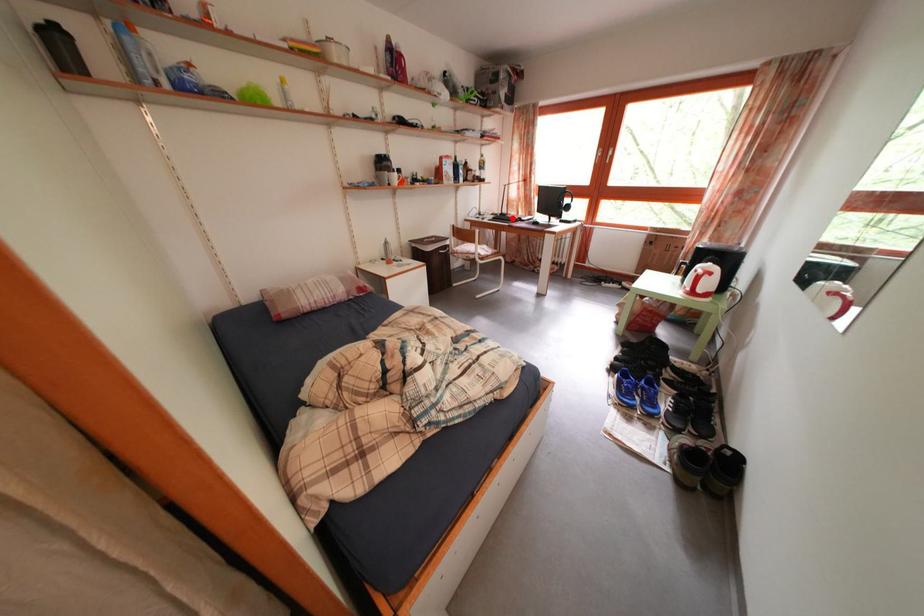
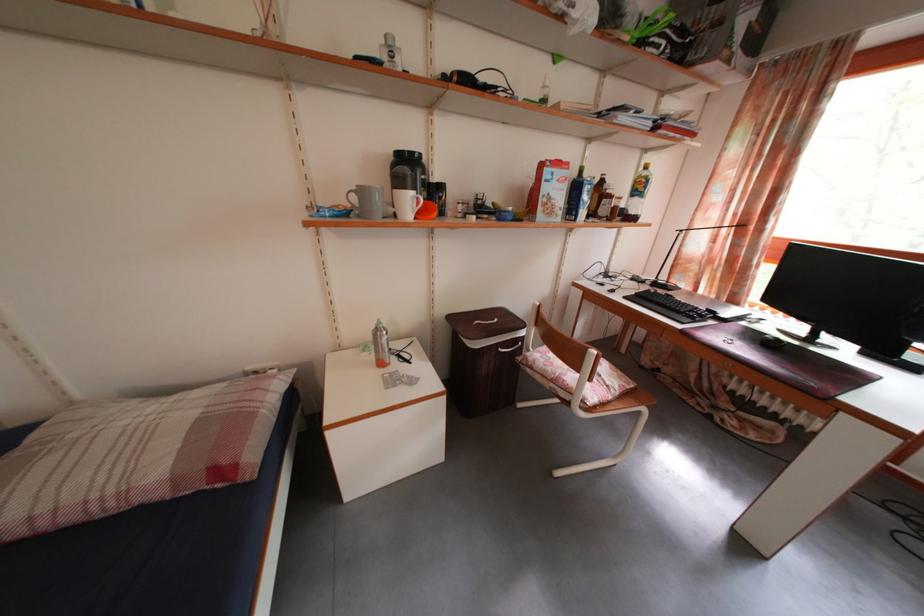
Question: I am providing you with two images of the same scene from different viewpoints. In image1, a red point is highlighted. Considering the same 3D point in image2, which of the following is correct?

Choices:
 (A) It is closer
 (B) It is farther

Answer: (B)